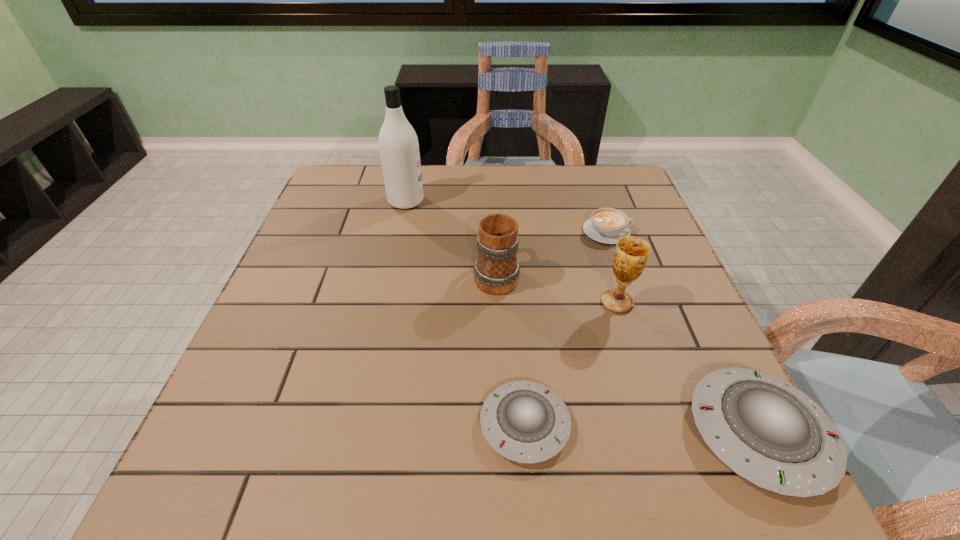
Identify the location of free space that is in between the mug and the second farthest object. The width and height of the screenshot is (960, 540). (552, 253).

Find the location of `free space between the chalice and the left saucer`. free space between the chalice and the left saucer is located at coordinates (571, 363).

You are a GUI agent. You are given a task and a screenshot of the screen. Output one action in this format:
    pyautogui.click(x=<x>, y=<y>)
    Task: Click on the free spot between the chalice and the cappuccino
    
    Given the screenshot: What is the action you would take?
    pyautogui.click(x=612, y=267)

Where is `free space between the right saucer and the mug`? free space between the right saucer and the mug is located at coordinates click(627, 354).

You are a GUI agent. You are given a task and a screenshot of the screen. Output one action in this format:
    pyautogui.click(x=<x>, y=<y>)
    Task: Click on the free space between the cappuccino and the left saucer
    
    Given the screenshot: What is the action you would take?
    pyautogui.click(x=566, y=328)

Locate an element on the screen. free spot between the mug and the leftmost object is located at coordinates (451, 238).

Where is `unoccupied position between the mug and the shorter saucer`? The width and height of the screenshot is (960, 540). unoccupied position between the mug and the shorter saucer is located at coordinates (511, 349).

Identify the location of the fourth closest object to the shampoo. The image size is (960, 540). point(526,422).

Identify which object is the closest to the leftmost object. Please provide its 2D coordinates. Your answer should be formatted as a tuple, i.e. [(x, y)], where the tuple contains the x and y coordinates of a point satisfying the conditions above.

[(496, 270)]

Where is `blank area in the image that satisfies the following two spatial constraints: 1. on the side of the cappuccino with the handle; 2. on the front side of the left saucer`? The width and height of the screenshot is (960, 540). blank area in the image that satisfies the following two spatial constraints: 1. on the side of the cappuccino with the handle; 2. on the front side of the left saucer is located at coordinates (674, 424).